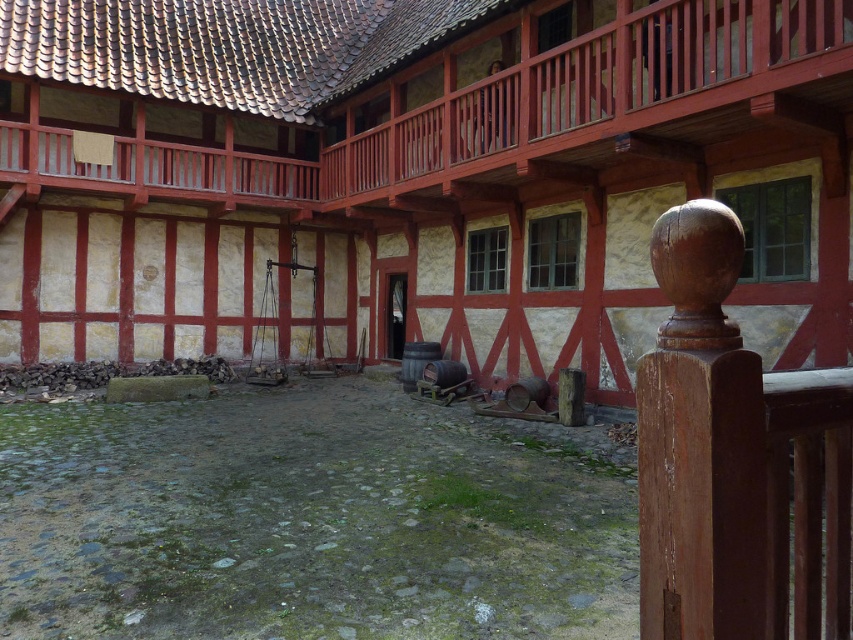
You are standing in the courtyard and want to place a tall potted plant that needs to be visible from both the wooden balcony at upper center and the wooden post at lower right. Considering their heights, which object should the plant be placed closer to?

The wooden balcony at upper center is taller than the wooden post at lower right. To ensure visibility from both locations, the plant should be placed closer to the wooden post at lower right so that it can be seen from the higher balcony as well.